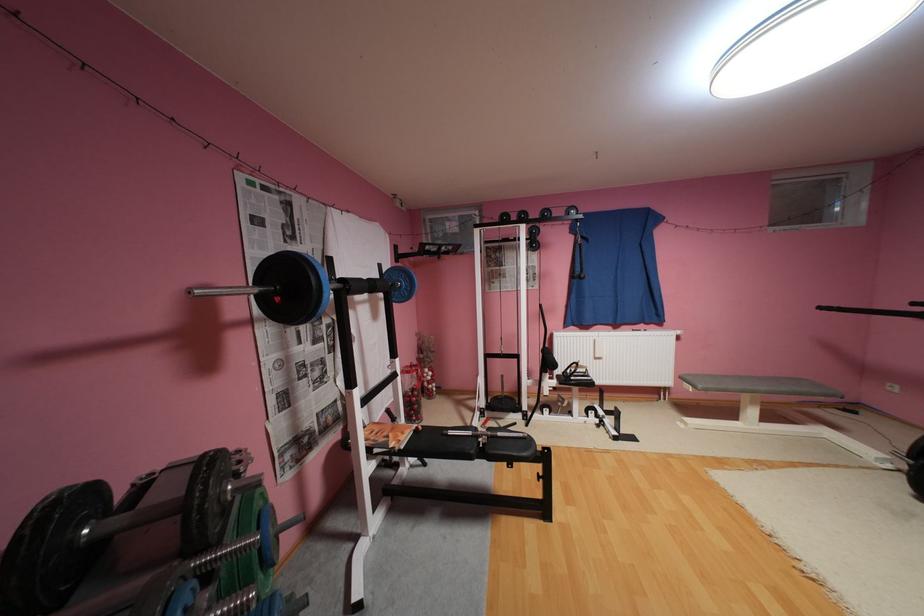
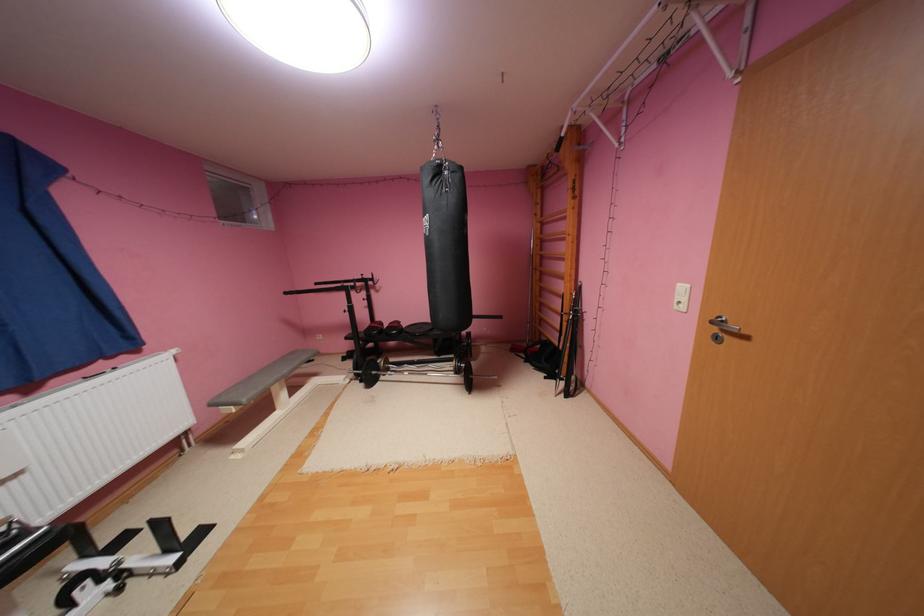
The point at (830, 308) is marked in the first image. Where is the corresponding point in the second image?

(295, 293)